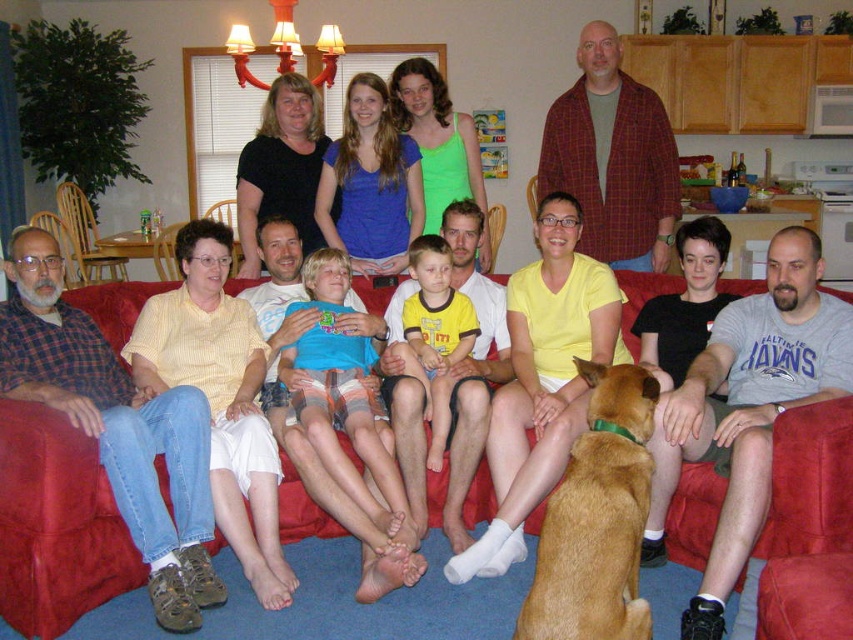
Does yellow matte shirt at center appear on the right side of yellow t-shirt at center?

Correct, you'll find yellow matte shirt at center to the right of yellow t-shirt at center.

Does point (566, 228) come behind point (473, 326)?

No, it is in front of (473, 326).

Is point (561, 404) positioned after point (409, 301)?

No, it is in front of (409, 301).

Where is `yellow matte shirt at center`? yellow matte shirt at center is located at coordinates (543, 380).

Does blue cotton shirt at center have a lesser width compared to yellow t-shirt at center?

Incorrect, blue cotton shirt at center's width is not less than yellow t-shirt at center's.

Is the position of blue cotton shirt at center more distant than that of yellow t-shirt at center?

No, it is not.

The height and width of the screenshot is (640, 853). What do you see at coordinates (341, 396) in the screenshot?
I see `blue cotton shirt at center` at bounding box center [341, 396].

Find the location of a particular element. This screenshot has width=853, height=640. blue cotton shirt at center is located at coordinates (341, 396).

Looking at this image, which is above, red fabric couch at center or blue cotton shirt at center?

blue cotton shirt at center is higher up.

Does red fabric couch at center have a greater width compared to blue cotton shirt at center?

Incorrect, red fabric couch at center's width does not surpass blue cotton shirt at center's.

Identify the location of red fabric couch at center. The width and height of the screenshot is (853, 640). (56, 524).

The height and width of the screenshot is (640, 853). I want to click on red fabric couch at center, so click(x=56, y=524).